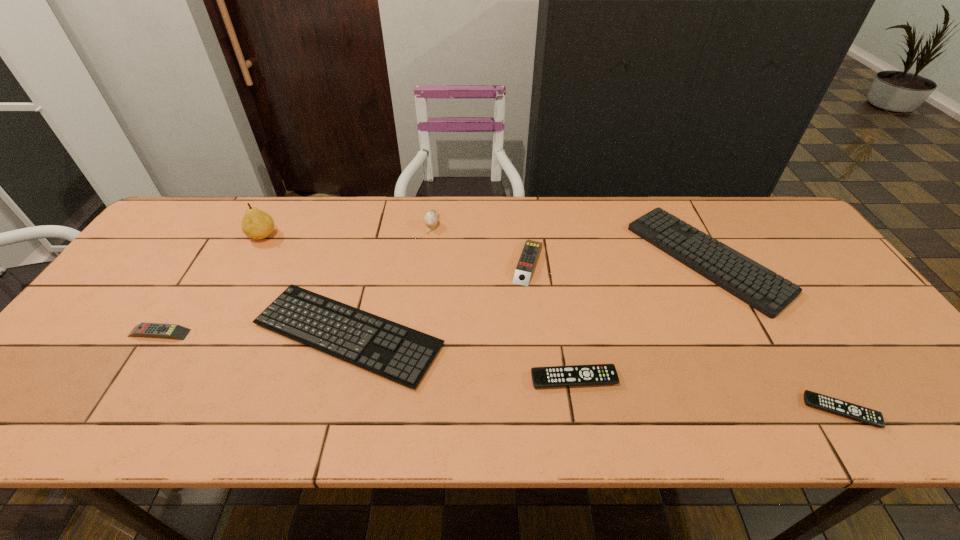
Locate an element on the screen. vacant space situated 0.110m on the back of the farther black remote control is located at coordinates (565, 329).

Locate an element on the screen. The width and height of the screenshot is (960, 540). vacant region located 0.340m on the back of the shortest object is located at coordinates (760, 282).

The width and height of the screenshot is (960, 540). Find the location of `pear present at the far edge`. pear present at the far edge is located at coordinates (256, 224).

The width and height of the screenshot is (960, 540). What are the coordinates of `escargot located in the far edge section of the desktop` in the screenshot? It's located at (430, 218).

This screenshot has width=960, height=540. Find the location of `computer keyboard that is at the far edge`. computer keyboard that is at the far edge is located at coordinates (754, 284).

Image resolution: width=960 pixels, height=540 pixels. What are the coordinates of `remote control present at the far edge` in the screenshot? It's located at (526, 263).

You are a GUI agent. You are given a task and a screenshot of the screen. Output one action in this format:
    pyautogui.click(x=<x>, y=<y>)
    Task: Click on the object that is at the near edge
    
    Given the screenshot: What is the action you would take?
    pyautogui.click(x=859, y=413)

The image size is (960, 540). What are the coordinates of `object present at the left edge` in the screenshot? It's located at pyautogui.click(x=174, y=331).

This screenshot has height=540, width=960. I want to click on computer keyboard situated at the right edge, so click(x=754, y=284).

Where is `remote control that is at the right edge`? This screenshot has width=960, height=540. remote control that is at the right edge is located at coordinates (859, 413).